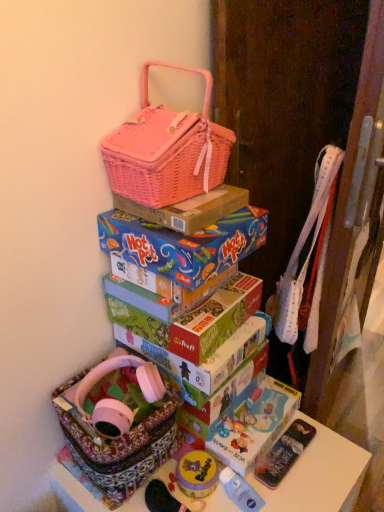
Find the location of `free spot to the right of matte plastic toy at lower center`. free spot to the right of matte plastic toy at lower center is located at coordinates (314, 480).